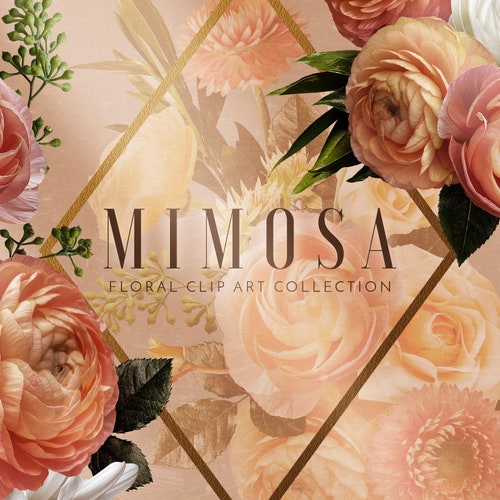
This screenshot has width=500, height=500. I want to click on art, so click(x=257, y=281).